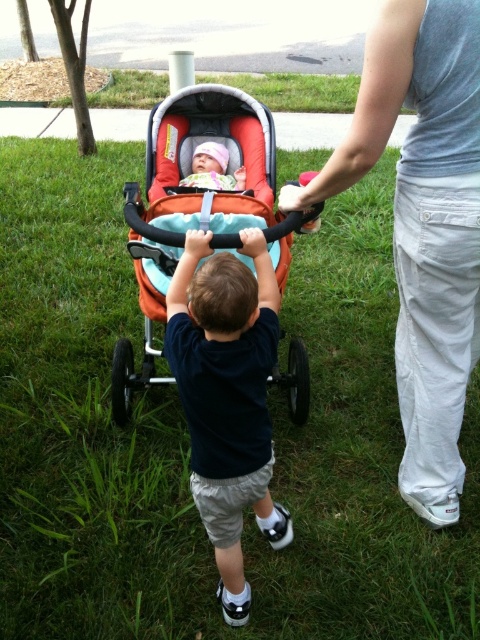
You are a photographer trying to capture a photo of the orange fabric baby carriage at center and the gray cotton shirt at upper right. From the photographer perspective, which object is positioned to the right side of the other?

The gray cotton shirt at upper right is positioned to the right of orange fabric baby carriage at center.

From the picture: What is the color of the clothing item located at the point with coordinates (x=423, y=225) in the image?

The point at coordinates (x=423, y=225) marks the gray cotton shirt at upper right.